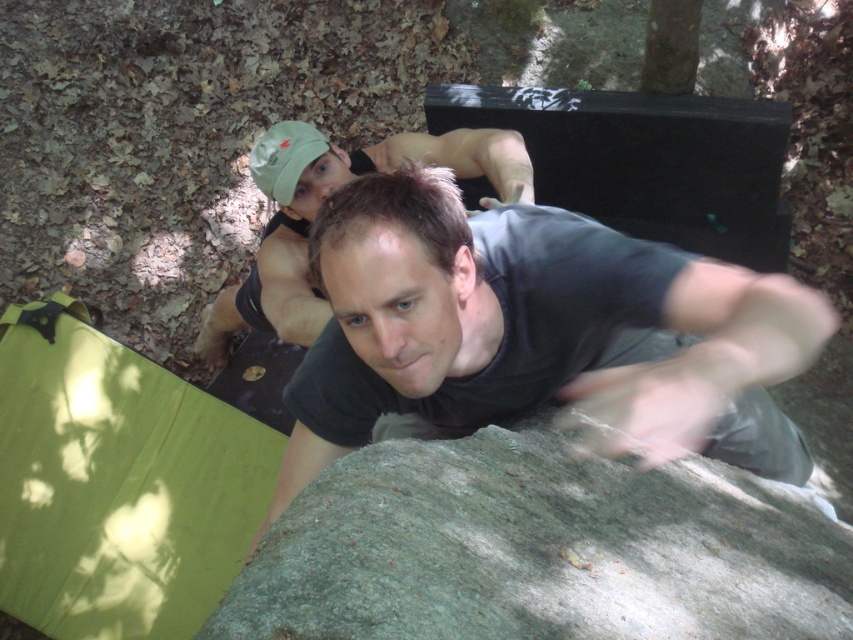
Question: Which of the following is the farthest from the observer?

Choices:
 (A) green rough rock at center
 (B) dark gray t-shirt at center
 (C) matte black shirt at upper center

Answer: (C)

Question: Is green rough rock at center wider than matte black shirt at upper center?

Choices:
 (A) yes
 (B) no

Answer: (B)

Question: Does dark gray t-shirt at center appear on the right side of green rough rock at center?

Choices:
 (A) no
 (B) yes

Answer: (B)

Question: Among these objects, which one is farthest from the camera?

Choices:
 (A) green rough rock at center
 (B) matte black shirt at upper center
 (C) dark gray t-shirt at center

Answer: (B)

Question: Is dark gray t-shirt at center to the left of green rough rock at center from the viewer's perspective?

Choices:
 (A) no
 (B) yes

Answer: (A)

Question: Which point is farther to the camera?

Choices:
 (A) (283, 212)
 (B) (286, 540)

Answer: (A)